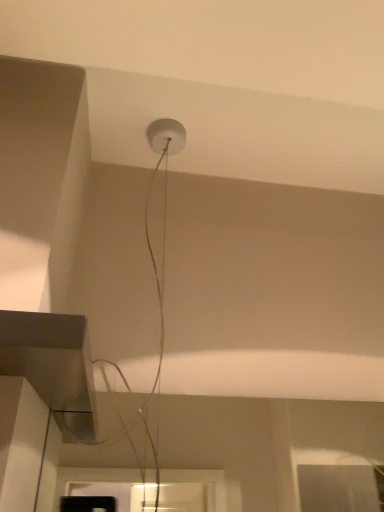
This screenshot has width=384, height=512. Describe the element at coordinates (160, 345) in the screenshot. I see `white matte cable at upper center` at that location.

Identify the location of white matte cable at upper center. (160, 345).

Where is `white matte cable at upper center`? white matte cable at upper center is located at coordinates (160, 345).